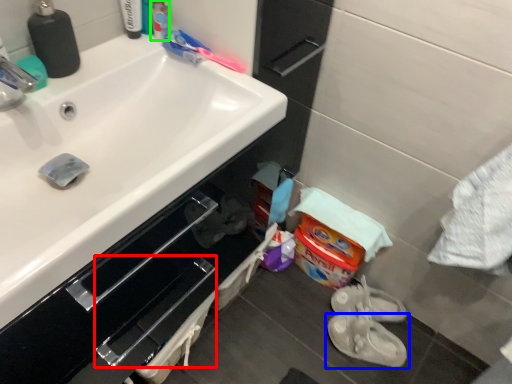
Question: Considering the real-world distances, which object is closest to drawer (highlighted by a red box)? footwear (highlighted by a blue box) or toiletry (highlighted by a green box).

Choices:
 (A) footwear
 (B) toiletry

Answer: (A)